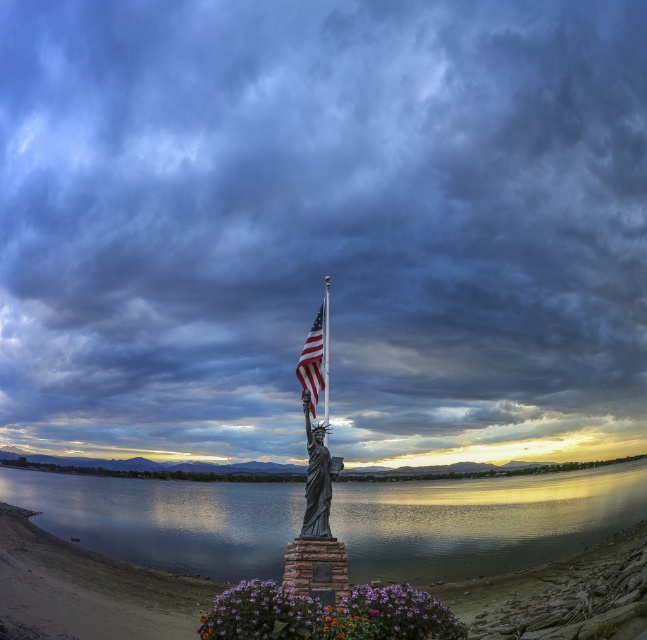
Consider the image. You are standing at the lakeside and see the metallic statue at center and the polished metal flag pole at center. Which object is closer to you?

The metallic statue at center is closer to you because the polished metal flag pole at center is behind it.

You are standing at the center of the image and want to walk directly towards the glossy water at statue center. What direction should you move in?

The glossy water at statue center is located at coordinates 0.816 on the x axis and 0.743 on the y axis. Since you are at the center, which is at coordinates (323,320), you should move towards the northeast direction to reach the glossy water at statue center.

You are standing at the lakeside and see the point marked at coordinates point (384, 506). If you want to reach that point quickly, what is the closest distance you need to travel?

The closest distance you need to travel to reach point (384, 506) is 219.60 meters.